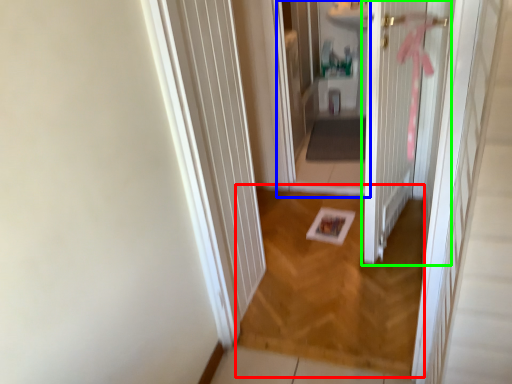
Question: Which is nearer to the plain (highlighted by a red box)? corridor (highlighted by a blue box) or door (highlighted by a green box).

Choices:
 (A) corridor
 (B) door

Answer: (B)